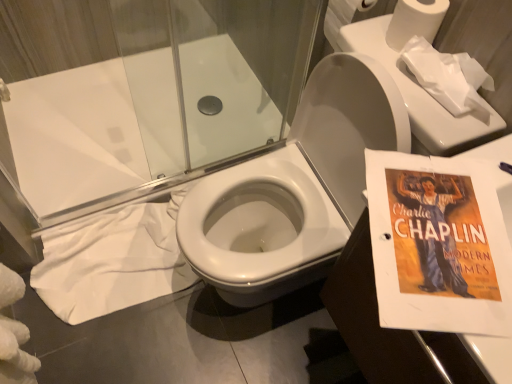
Image resolution: width=512 pixels, height=384 pixels. Find the location of `vacant space that is to the left of white paper at upper right, which is counted as the 3th toilet paper, starting from the back`. vacant space that is to the left of white paper at upper right, which is counted as the 3th toilet paper, starting from the back is located at coordinates (385, 70).